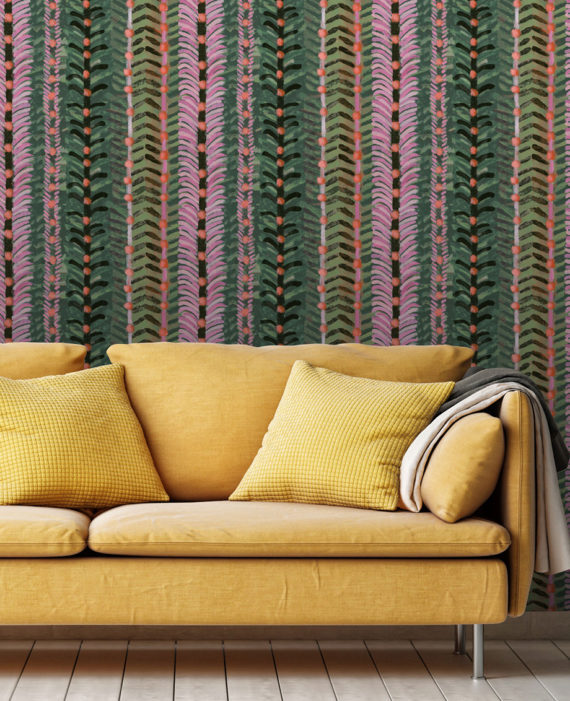
The width and height of the screenshot is (570, 701). I want to click on blanket, so click(484, 376).